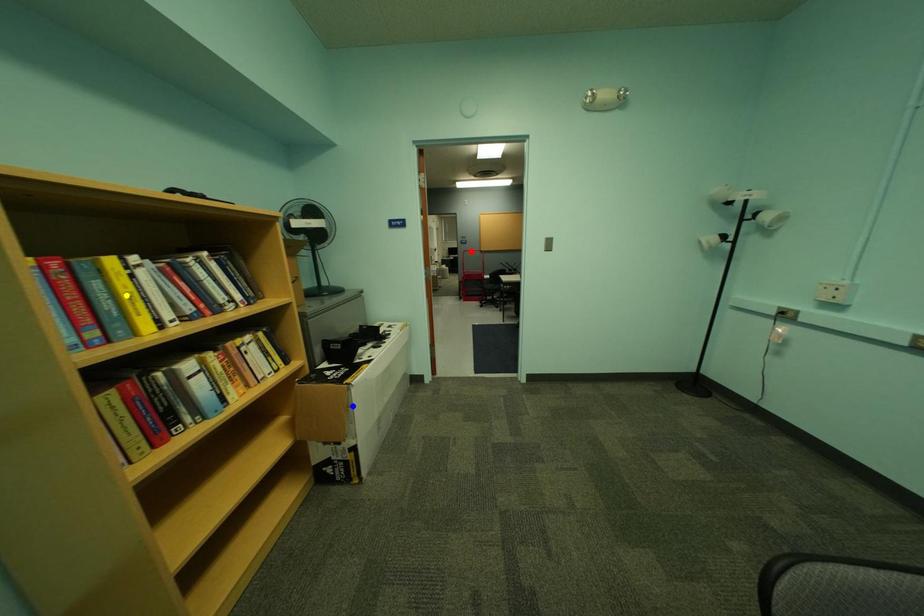
Order these from farthest to nearest:
yellow point | red point | blue point

red point
blue point
yellow point